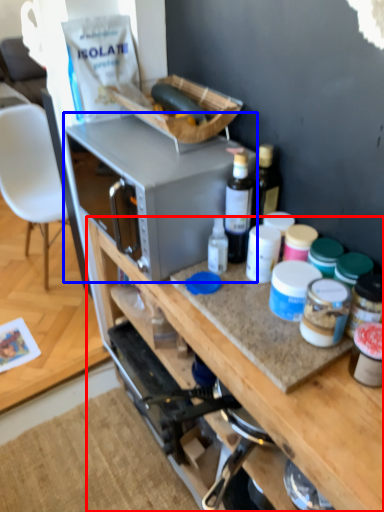
Question: Which point is closer to the camera, cabinetry (highlighted by a red box) or microwave oven (highlighted by a blue box)?

Choices:
 (A) cabinetry
 (B) microwave oven

Answer: (A)